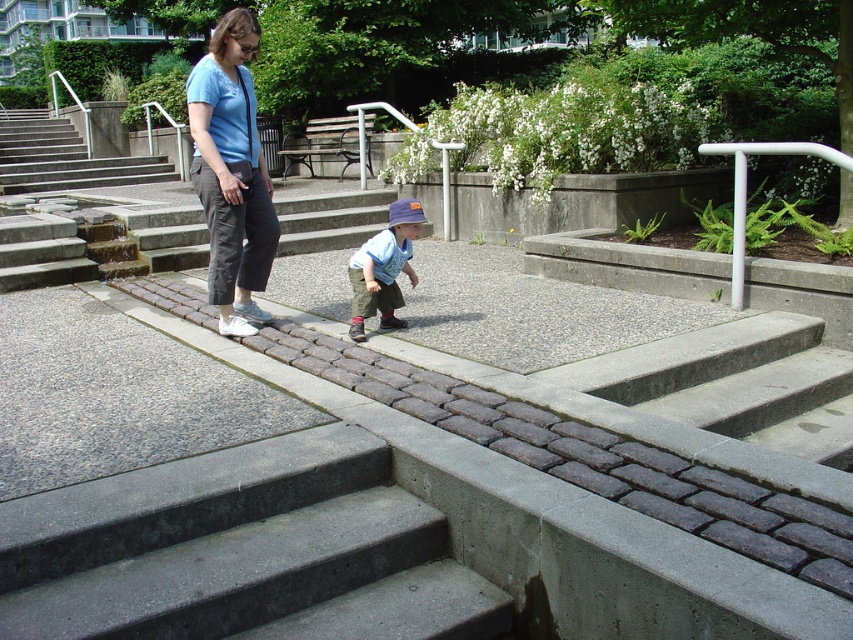
Who is lower down, concrete steps at lower center or blue cotton shirt at center?

concrete steps at lower center

Between point (267, 572) and point (358, 340), which one is positioned in front?

Point (267, 572) is in front.

Locate an element on the screen. concrete steps at lower center is located at coordinates (242, 550).

Where is `concrete steps at lower center`? The image size is (853, 640). concrete steps at lower center is located at coordinates (242, 550).

Does matte blue shirt at center appear on the left side of silver metallic handrail at upper right?

Yes, matte blue shirt at center is to the left of silver metallic handrail at upper right.

Who is lower down, matte blue shirt at center or silver metallic handrail at upper right?

matte blue shirt at center is lower down.

Does point (256, 278) come closer to viewer compared to point (738, 164)?

Yes.

Image resolution: width=853 pixels, height=640 pixels. I want to click on matte blue shirt at center, so click(231, 172).

Can you confirm if matte blue shirt at center is taller than blue cotton shirt at center?

Yes.

Is point (221, 52) in front of point (379, 280)?

Yes, it is in front of point (379, 280).

Who is more forward, (248, 220) or (404, 246)?

Positioned in front is point (404, 246).

The width and height of the screenshot is (853, 640). What are the coordinates of `matte blue shirt at center` in the screenshot? It's located at (231, 172).